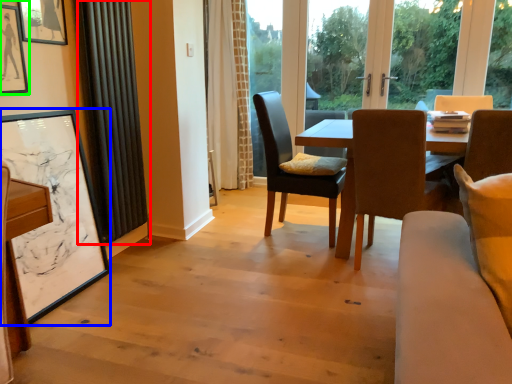
Question: Which object is positioned farthest from curtain (highlighted by a red box)? Select from picture frame (highlighted by a blue box) and picture frame (highlighted by a green box).

Choices:
 (A) picture frame
 (B) picture frame

Answer: (B)